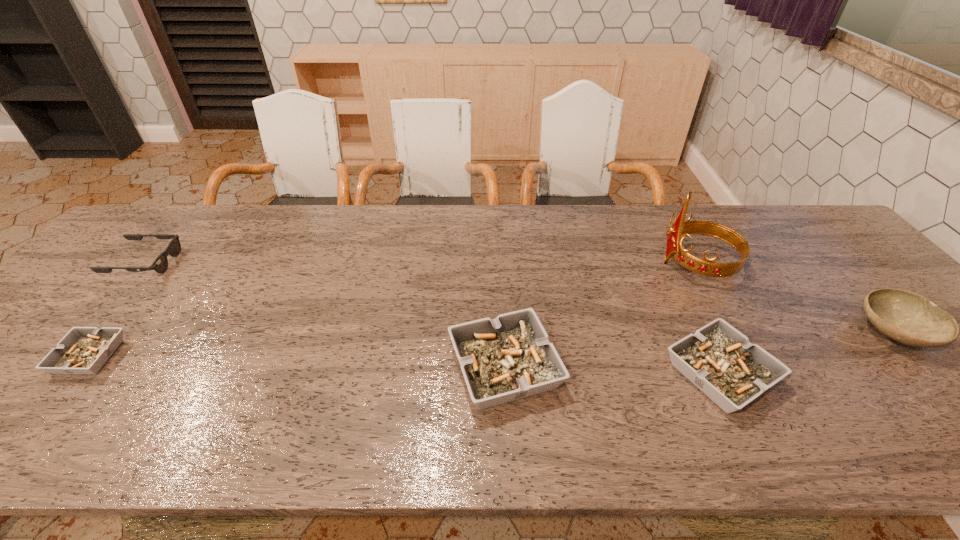
The width and height of the screenshot is (960, 540). Identify the location of vacant space located on the front-facing side of the tallest object. (582, 264).

Identify the location of vacant space situated 0.070m on the front-facing side of the tallest object. Image resolution: width=960 pixels, height=540 pixels. (634, 264).

The height and width of the screenshot is (540, 960). Find the location of `vacant point located 0.280m on the temples of the sunglasses`. vacant point located 0.280m on the temples of the sunglasses is located at coordinates (272, 263).

Where is `tiara at the far edge`? tiara at the far edge is located at coordinates (680, 228).

I want to click on sunglasses present at the far edge, so click(160, 264).

Locate an element on the screen. This screenshot has width=960, height=540. ashtray that is at the left edge is located at coordinates (83, 350).

At what (x,y) coordinates should I click in order to perform the action: click on sunglasses positioned at the left edge. Please return your answer as a coordinate pair (x, y). This screenshot has height=540, width=960. Looking at the image, I should click on (160, 264).

This screenshot has width=960, height=540. What are the coordinates of `object that is at the far left corner` in the screenshot? It's located at (160, 264).

What are the coordinates of `object that is positioned at the near left corner` in the screenshot? It's located at (83, 350).

In the image, there is a desktop. Where is `free space at the far edge`? free space at the far edge is located at coordinates (446, 214).